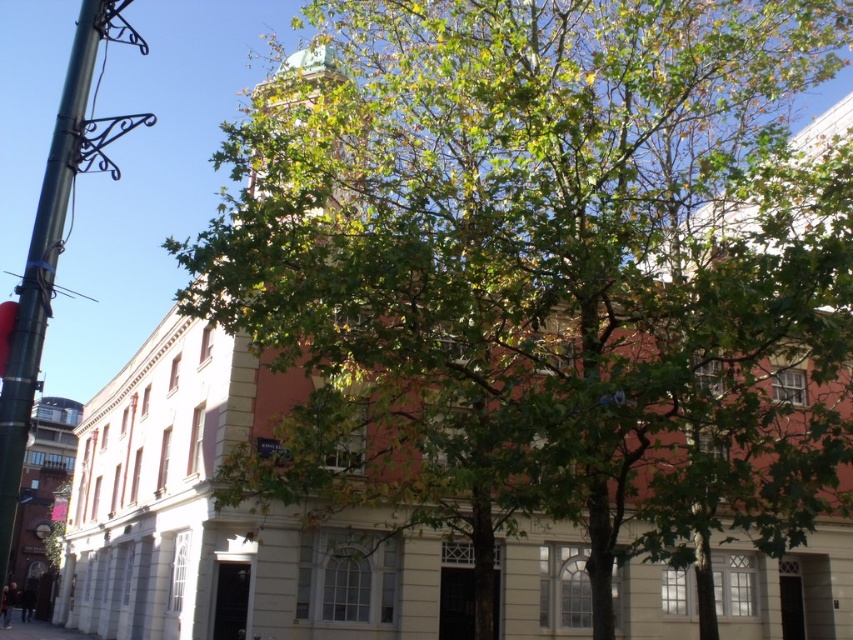
You are standing at the entrance of the historic building and want to locate the green metallic pole at left. According to the coordinates provided, where should you look relative to the building?

The green metallic pole at left is located at coordinates point (44, 266), which means it is positioned to the left side and slightly downward from the building entrance.

You are a tourist standing on the concrete pavement at lower left and want to take a photo of the green copper dome at center. In which direction should you move to frame the dome in your camera?

The green copper dome at center is to the right of concrete pavement at lower left, so you should move to your right to frame the dome in your camera.